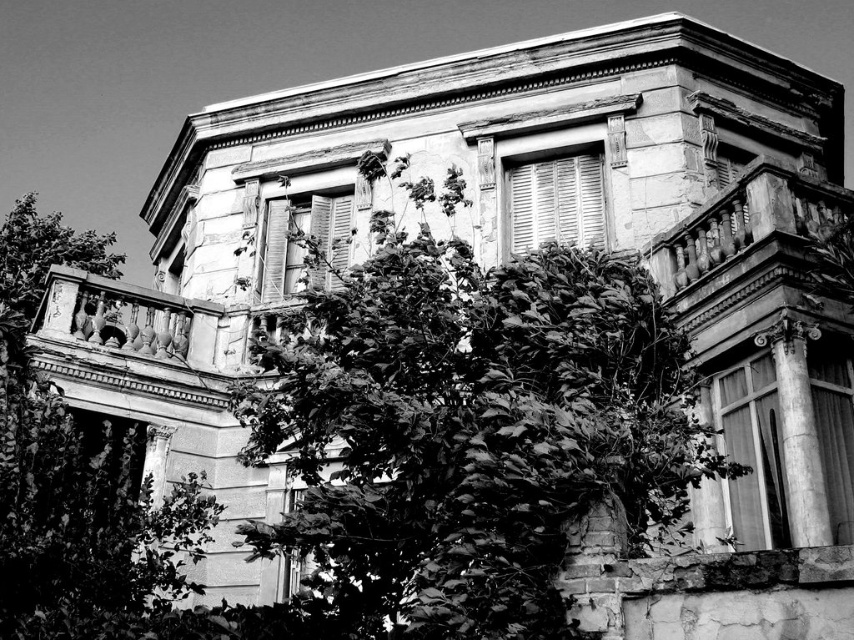
Can you confirm if dark green leafy tree at center is bigger than leaves green textured tree at left?

Actually, dark green leafy tree at center might be smaller than leaves green textured tree at left.

What do you see at coordinates (468, 433) in the screenshot?
I see `dark green leafy tree at center` at bounding box center [468, 433].

Between point (591, 291) and point (22, 612), which one is positioned in front?

Point (22, 612)

The height and width of the screenshot is (640, 854). Find the location of `dark green leafy tree at center`. dark green leafy tree at center is located at coordinates (468, 433).